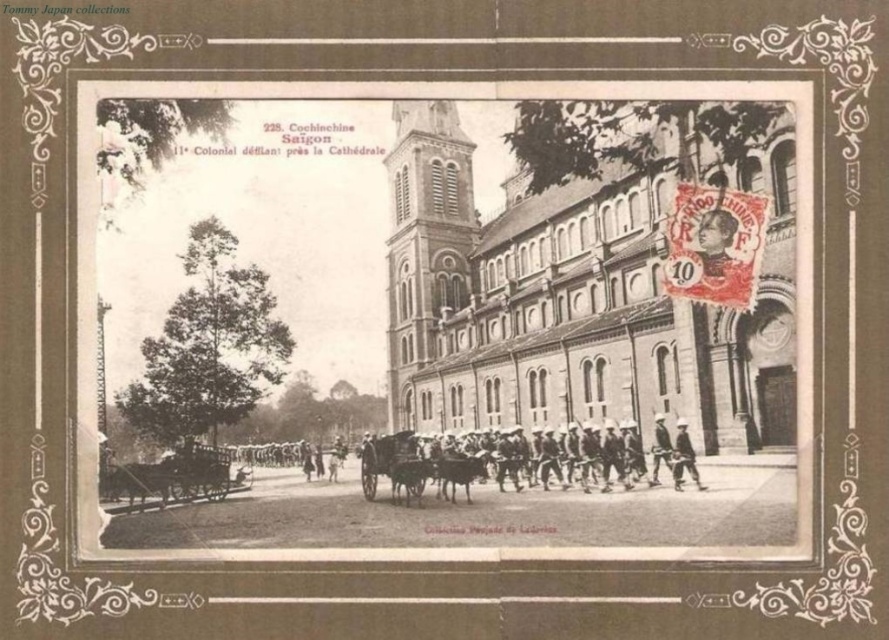
Based on the photo, based on the postcard scene, where is the stone church at center located in terms of coordinates?

The stone church at center is located at coordinates point (581, 292).

You are a photographer standing next to the camera in the scene. You want to take a photo of the light brown leather hat at lower right. Is the hat within the camera lens range of 60 meters? Please explain your reasoning.

The light brown leather hat at lower right and camera are 65.54 meters apart. Since the camera lens range is 60 meters, the hat is 5.54 meters beyond the maximum range. Therefore, the hat would not be in focus and the photo would be blurry.